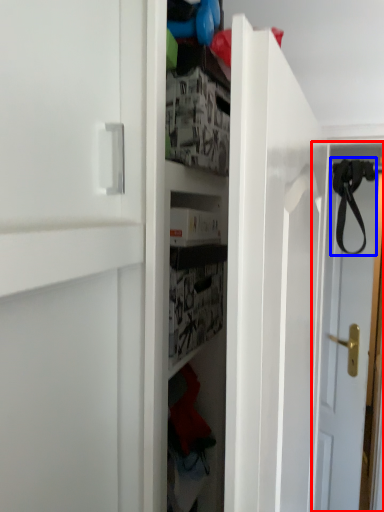
Question: Among these objects, which one is nearest to the camera, door (highlighted by a red box) or strap (highlighted by a blue box)?

Choices:
 (A) door
 (B) strap

Answer: (B)